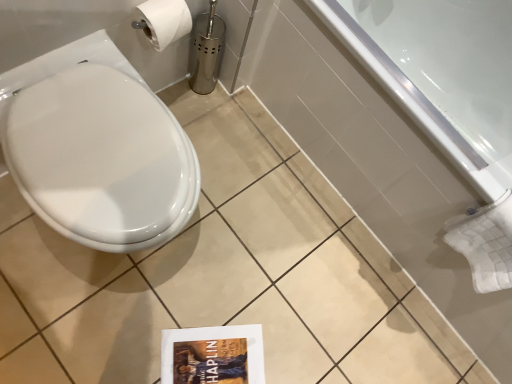
Question: From a real-world perspective, does white glossy bathtub at upper right stand above white glossy toilet at left?

Choices:
 (A) no
 (B) yes

Answer: (A)

Question: From the image's perspective, is white glossy bathtub at upper right over white glossy toilet at left?

Choices:
 (A) no
 (B) yes

Answer: (B)

Question: Does white glossy bathtub at upper right have a lesser height compared to white glossy toilet at left?

Choices:
 (A) no
 (B) yes

Answer: (A)

Question: Considering the relative sizes of white glossy bathtub at upper right and white glossy toilet at left in the image provided, is white glossy bathtub at upper right taller than white glossy toilet at left?

Choices:
 (A) no
 (B) yes

Answer: (B)

Question: Can you confirm if white glossy bathtub at upper right is wider than white glossy toilet at left?

Choices:
 (A) yes
 (B) no

Answer: (A)

Question: Is white glossy bathtub at upper right positioned before white glossy toilet at left?

Choices:
 (A) no
 (B) yes

Answer: (A)

Question: Are white glossy toilet at left and white glossy bathtub at upper right located far from each other?

Choices:
 (A) yes
 (B) no

Answer: (B)

Question: Is white glossy toilet at left looking in the opposite direction of white glossy bathtub at upper right?

Choices:
 (A) no
 (B) yes

Answer: (A)

Question: Does white glossy toilet at left have a lesser height compared to white glossy bathtub at upper right?

Choices:
 (A) no
 (B) yes

Answer: (B)

Question: Can white glossy bathtub at upper right be found inside white glossy toilet at left?

Choices:
 (A) no
 (B) yes

Answer: (A)

Question: Can you confirm if white glossy toilet at left is positioned to the left of white glossy bathtub at upper right?

Choices:
 (A) yes
 (B) no

Answer: (A)

Question: Can you confirm if white glossy toilet at left is smaller than white glossy bathtub at upper right?

Choices:
 (A) no
 (B) yes

Answer: (B)

Question: In the image, is white glossy bathtub at upper right positioned in front of or behind white glossy toilet at left?

Choices:
 (A) behind
 (B) front

Answer: (A)